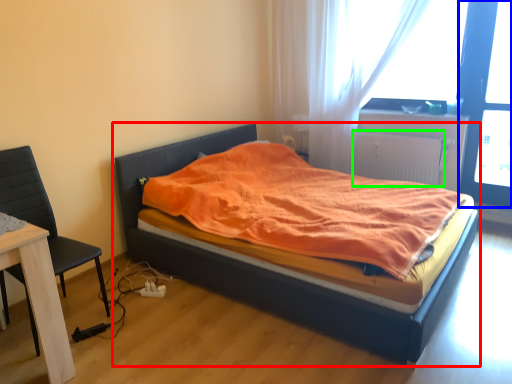
Question: Estimate the real-world distances between objects in this image. Which object is closer to bed (highlighted by a red box), screen door (highlighted by a blue box) or radiator (highlighted by a green box)?

Choices:
 (A) screen door
 (B) radiator

Answer: (B)